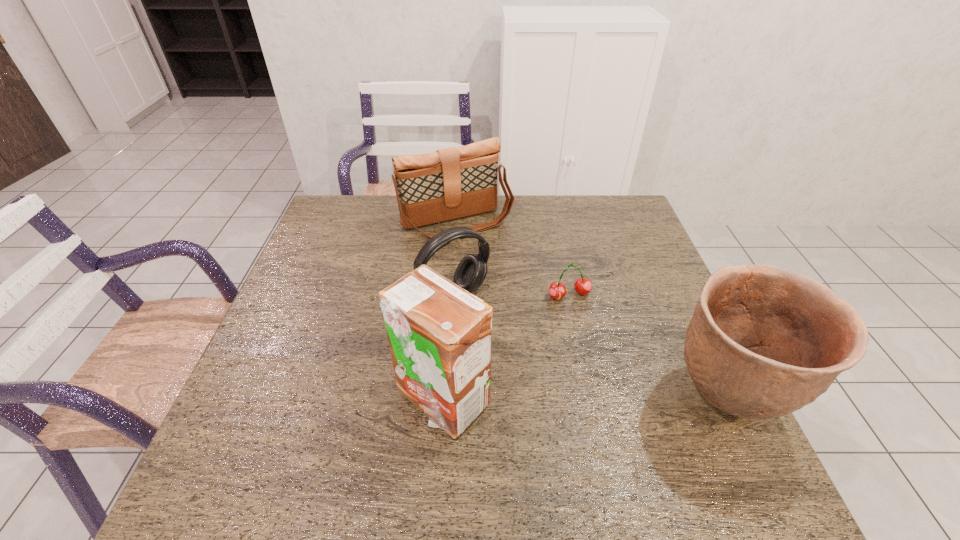
Where is `object that is at the near right corner`? object that is at the near right corner is located at coordinates (764, 341).

In the image, there is a desktop. At what (x,y) coordinates should I click in order to perform the action: click on vacant space at the far edge. Please return your answer as a coordinate pair (x, y). The width and height of the screenshot is (960, 540). Looking at the image, I should click on (545, 207).

The height and width of the screenshot is (540, 960). I want to click on blank space at the near edge of the desktop, so click(322, 441).

The height and width of the screenshot is (540, 960). What are the coordinates of `vacant area at the left edge of the desktop` in the screenshot? It's located at (320, 252).

Where is `free region at the right edge of the desktop`? This screenshot has width=960, height=540. free region at the right edge of the desktop is located at coordinates (656, 299).

At what (x,y) coordinates should I click in order to perform the action: click on free location at the far left corner of the desktop. Please return your answer as a coordinate pair (x, y). This screenshot has width=960, height=540. Looking at the image, I should click on (354, 227).

I want to click on vacant area at the near left corner, so click(x=265, y=416).

Locate an element on the screen. vacant space at the far right corner is located at coordinates (605, 207).

Identify the location of unoccupied area between the cherry and the pottery. This screenshot has width=960, height=540. (647, 347).

Where is `free space between the second shortest object and the rightmost object`? free space between the second shortest object and the rightmost object is located at coordinates (589, 346).